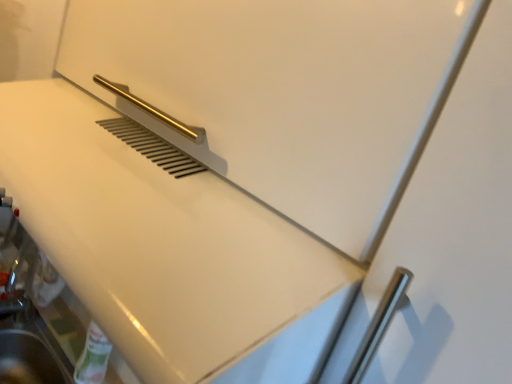
Question: Should I look upward or downward to see white glossy counter top at center?

Choices:
 (A) down
 (B) up

Answer: (B)